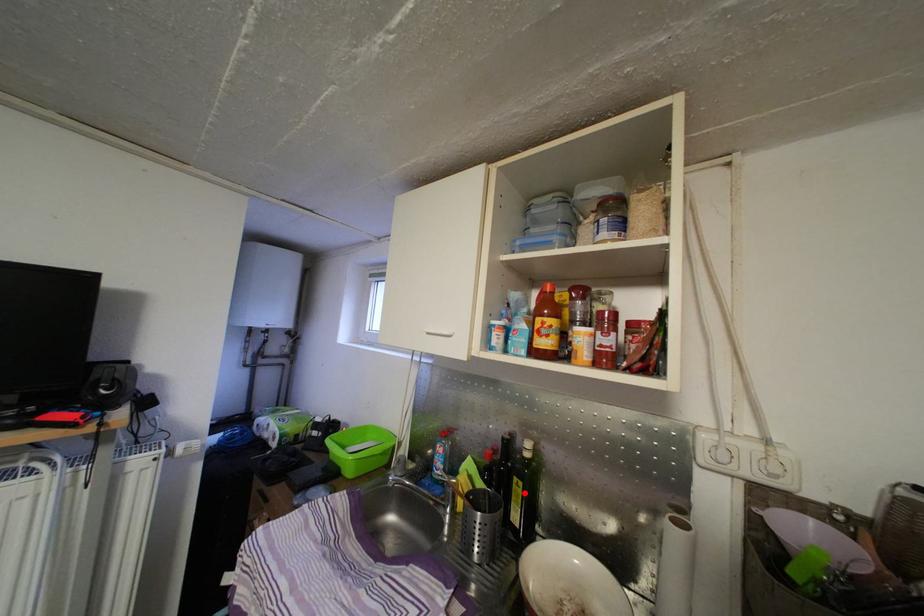
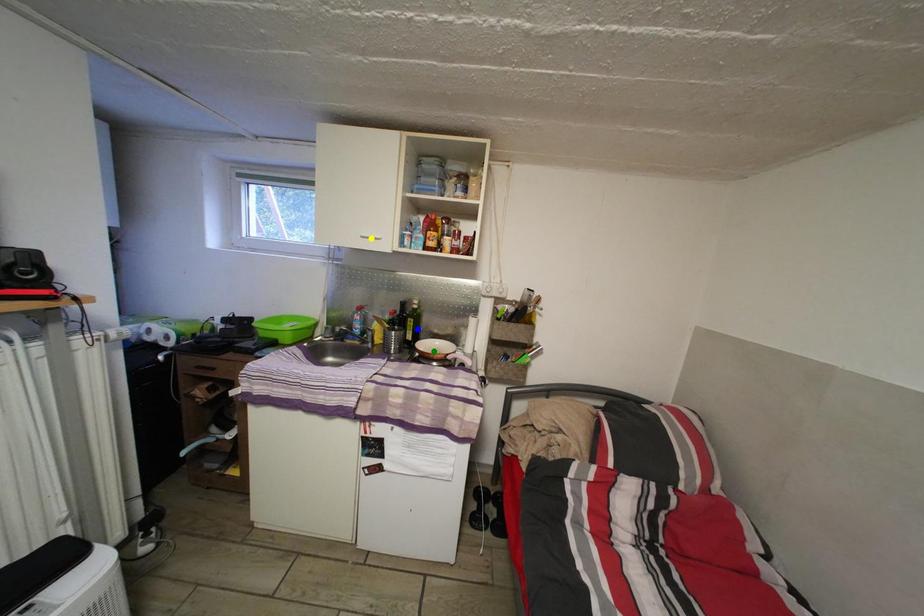
Question: I am providing you with two images of the same scene from different viewpoints. A red point is marked on the first image. You are given multiple points on the second image. Which point in image 2 represents the same 3d spot as the red point in image 1?

Choices:
 (A) yellow point
 (B) blue point
 (C) green point

Answer: (B)